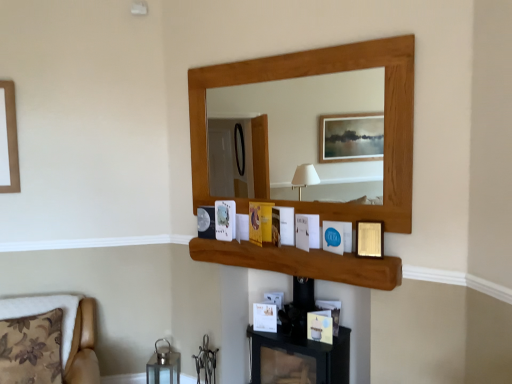
Question: Does gold metallic picture frame at upper center, positioned as the second picture frame in bottom-to-top order, have a larger size compared to wooden shelf at center?

Choices:
 (A) yes
 (B) no

Answer: (B)

Question: Is gold metallic picture frame at upper center, positioned as the second picture frame in bottom-to-top order, directly adjacent to wooden shelf at center?

Choices:
 (A) yes
 (B) no

Answer: (B)

Question: Is gold metallic picture frame at upper center, which is the 1th picture frame in front-to-back order, oriented towards wooden shelf at center?

Choices:
 (A) no
 (B) yes

Answer: (A)

Question: Considering the relative sizes of gold metallic picture frame at upper center, arranged as the 1th picture frame when viewed from the right, and wooden shelf at center in the image provided, is gold metallic picture frame at upper center, arranged as the 1th picture frame when viewed from the right, wider than wooden shelf at center?

Choices:
 (A) yes
 (B) no

Answer: (B)

Question: Is gold metallic picture frame at upper center, the 5th picture frame from the left, not near wooden shelf at center?

Choices:
 (A) yes
 (B) no

Answer: (B)

Question: Is point (324, 233) closer or farther from the camera than point (204, 213)?

Choices:
 (A) farther
 (B) closer

Answer: (B)

Question: Considering the positions of blue paper at center, the second picture frame in the right-to-left sequence, and metallic silver picture frame at lower left, which is counted as the 1th picture frame, starting from the back, in the image, is blue paper at center, the second picture frame in the right-to-left sequence, bigger or smaller than metallic silver picture frame at lower left, which is counted as the 1th picture frame, starting from the back,?

Choices:
 (A) big
 (B) small

Answer: (A)

Question: Is blue paper at center, which is the fourth picture frame from left to right, wider or thinner than metallic silver picture frame at lower left, acting as the first picture frame starting from the left?

Choices:
 (A) thin
 (B) wide

Answer: (B)

Question: Based on their positions, is blue paper at center, which appears as the 3th picture frame when viewed from the top, located to the left or right of metallic silver picture frame at lower left, which is counted as the 1th picture frame, starting from the back?

Choices:
 (A) right
 (B) left

Answer: (A)

Question: Is metallic silver picture frame at lower left, the 4th picture frame from the bottom, spatially inside gold metallic picture frame at upper center, which is the 1th picture frame in front-to-back order, or outside of it?

Choices:
 (A) inside
 (B) outside

Answer: (B)

Question: Does point (214, 218) appear closer or farther from the camera than point (367, 253)?

Choices:
 (A) closer
 (B) farther

Answer: (B)

Question: In the image, is metallic silver picture frame at lower left, which is counted as the 1th picture frame, starting from the back, positioned in front of or behind gold metallic picture frame at upper center, the 5th picture frame from the left?

Choices:
 (A) front
 (B) behind

Answer: (B)

Question: Is metallic silver picture frame at lower left, which ranks as the 5th picture frame in front-to-back order, wider or thinner than gold metallic picture frame at upper center, the 5th picture frame from the left?

Choices:
 (A) wide
 (B) thin

Answer: (B)

Question: Is gold metallic picture frame at upper center, arranged as the 1th picture frame when viewed from the right, spatially inside matte gold picture frame at center, which ranks as the fifth picture frame in top-to-bottom order, or outside of it?

Choices:
 (A) inside
 (B) outside

Answer: (B)

Question: Relative to matte gold picture frame at center, the 3th picture frame in the right-to-left sequence, is gold metallic picture frame at upper center, which is the 1th picture frame in front-to-back order, in front or behind?

Choices:
 (A) front
 (B) behind

Answer: (A)